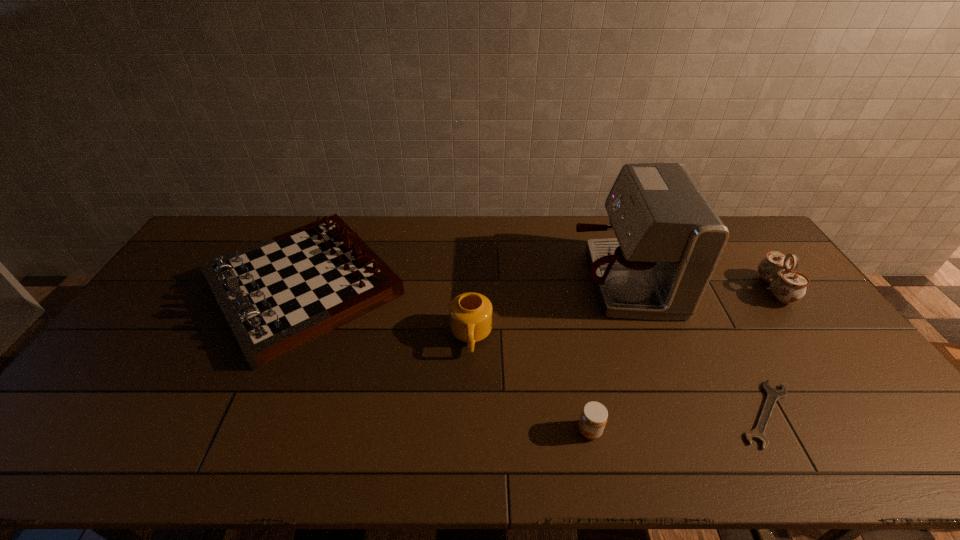
The width and height of the screenshot is (960, 540). I want to click on coffee maker, so click(669, 239).

Where is `the leftmost object`? This screenshot has height=540, width=960. the leftmost object is located at coordinates (279, 294).

You are a GUI agent. You are given a task and a screenshot of the screen. Output one action in this format:
    pyautogui.click(x=<x>, y=<y>)
    Task: Click on the rightmost object
    The image size is (960, 540).
    Given the screenshot: What is the action you would take?
    pyautogui.click(x=788, y=286)

I want to click on the second object from left to right, so click(x=470, y=314).

The width and height of the screenshot is (960, 540). I want to click on the third object from left to right, so pos(594,415).

I want to click on jam, so click(594, 415).

Locate an element on the screen. wrench is located at coordinates (773, 395).

You are a GUI agent. You are given a task and a screenshot of the screen. Output one action in this format:
    pyautogui.click(x=<x>, y=<y>)
    Task: Click on the vacant space situated 0.180m on the front of the coffee maker near the spout
    This screenshot has width=960, height=540.
    Given the screenshot: What is the action you would take?
    pyautogui.click(x=517, y=280)

The height and width of the screenshot is (540, 960). I want to click on blank space located 0.240m on the front of the coffee maker near the spout, so pos(499,280).

Locate an element on the screen. The width and height of the screenshot is (960, 540). vacant space located on the front of the coffee maker near the spout is located at coordinates point(466,280).